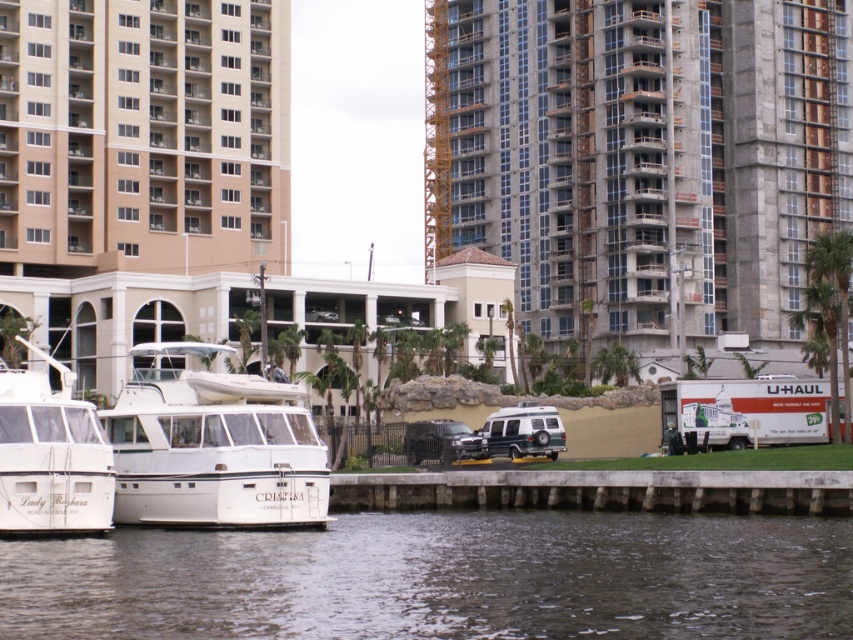
You are standing at the waterfront and want to take a photo of both the white motorboat named Lady Barbara and the U. Haul truck parked near the stone wall. Which point, point [160,589] or point [466,428], is better for capturing both subjects in the frame?

Point [160,589] is closer to the camera than point [466,428], so standing at point [160,589] would allow you to capture both the white motorboat named Lady Barbara and the U. Haul truck parked near the stone wall in the frame more effectively.

You are a delivery driver who needs to park your truck between the dark gray water at lower center and the concrete at lower center. The truck is 10 meters long. Can you fit it there without overlapping either the water or the concrete?

The distance between the dark gray water at lower center and the concrete at lower center is 11.18 meters. Since the truck is 10 meters long, it can fit between them without overlapping either the water or the concrete.

You are standing on the pier and looking at the dark gray water at lower center and the concrete at lower center. Which one takes up more space in the image?

The dark gray water at lower center takes up more space in the image because it is bigger than the concrete at lower center.